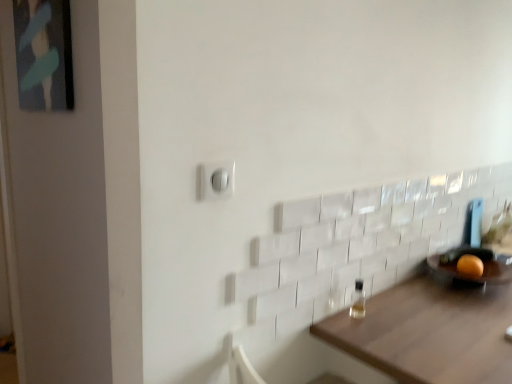
The height and width of the screenshot is (384, 512). What are the coordinates of `free spot to the right of transparent glass bottle at lower right` in the screenshot? It's located at (x=409, y=316).